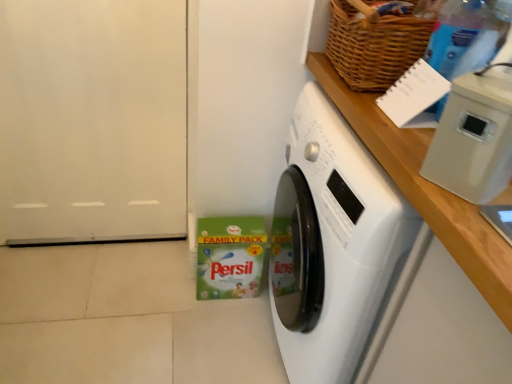
Question: Is white plastic container at upper right completely or partially inside white matte door at left?

Choices:
 (A) no
 (B) yes

Answer: (A)

Question: From the image's perspective, is white matte door at left above white plastic container at upper right?

Choices:
 (A) yes
 (B) no

Answer: (A)

Question: Would you say white matte door at left is a long distance from white plastic container at upper right?

Choices:
 (A) no
 (B) yes

Answer: (B)

Question: Can you confirm if white matte door at left is shorter than white plastic container at upper right?

Choices:
 (A) no
 (B) yes

Answer: (A)

Question: From the image's perspective, is white matte door at left below white plastic container at upper right?

Choices:
 (A) no
 (B) yes

Answer: (A)

Question: Is white matte door at left oriented away from white plastic container at upper right?

Choices:
 (A) yes
 (B) no

Answer: (B)

Question: Can you confirm if white plastic container at upper right is positioned to the right of transparent plastic bottle at upper right?

Choices:
 (A) no
 (B) yes

Answer: (A)

Question: Does white plastic container at upper right come in front of transparent plastic bottle at upper right?

Choices:
 (A) yes
 (B) no

Answer: (A)

Question: Is white plastic container at upper right looking in the opposite direction of transparent plastic bottle at upper right?

Choices:
 (A) no
 (B) yes

Answer: (A)

Question: Does white plastic container at upper right have a larger size compared to transparent plastic bottle at upper right?

Choices:
 (A) no
 (B) yes

Answer: (A)

Question: Would you say white plastic container at upper right is outside transparent plastic bottle at upper right?

Choices:
 (A) no
 (B) yes

Answer: (B)

Question: Can you confirm if white plastic container at upper right is positioned to the left of transparent plastic bottle at upper right?

Choices:
 (A) no
 (B) yes

Answer: (B)

Question: Is white glossy washing machine at center far from white matte door at left?

Choices:
 (A) no
 (B) yes

Answer: (A)